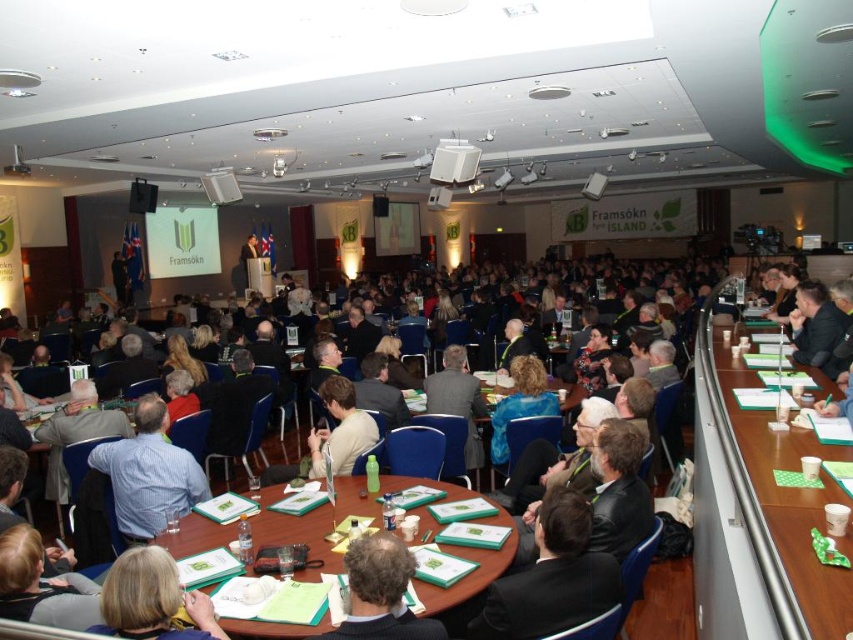
Find the location of a particular element. This screenshot has width=853, height=640. green plastic table at right is located at coordinates (758, 516).

Can you confirm if green plastic table at right is bigger than smooth paper folder at center?

Correct, green plastic table at right is larger in size than smooth paper folder at center.

Between point (762, 524) and point (167, 586), which one is positioned behind?

The point (167, 586) is behind.

Where is `green plastic table at right`? This screenshot has height=640, width=853. green plastic table at right is located at coordinates (758, 516).

Between green plastic table at right and green paper at center, which one is positioned higher?

Positioned higher is green plastic table at right.

Who is taller, green plastic table at right or green paper at center?

With more height is green plastic table at right.

What do you see at coordinates (758, 516) in the screenshot? I see `green plastic table at right` at bounding box center [758, 516].

Locate an element on the screen. green plastic table at right is located at coordinates (758, 516).

Is point (229, 524) in front of point (158, 596)?

That is False.

Looking at this image, is green paper at center below smooth paper folder at center?

Indeed, green paper at center is positioned under smooth paper folder at center.

Between point (469, 586) and point (131, 628), which one is positioned in front?

Point (131, 628)

Identify the location of green paper at center. (296, 532).